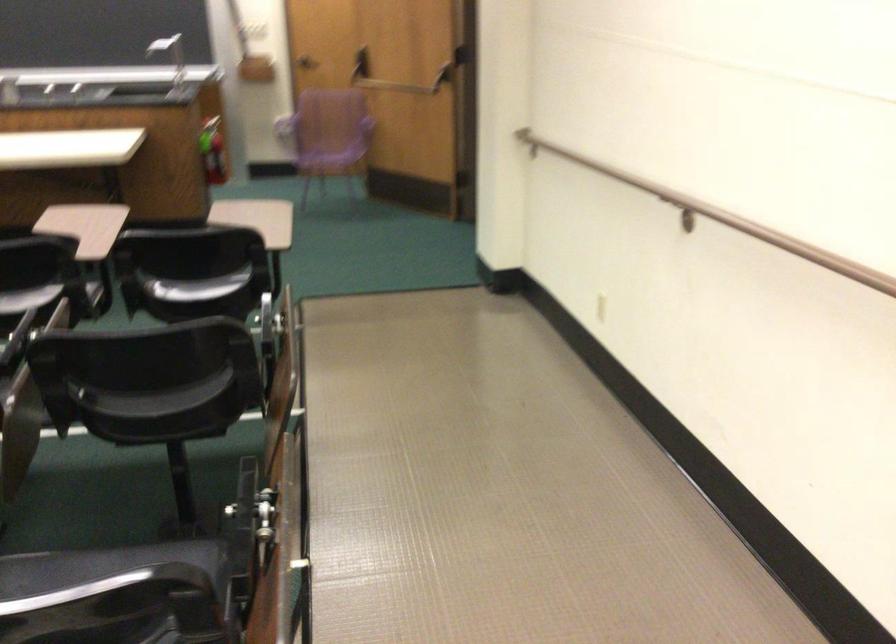
This screenshot has width=896, height=644. What are the coordinates of `white light switch` in the screenshot? It's located at (600, 307).